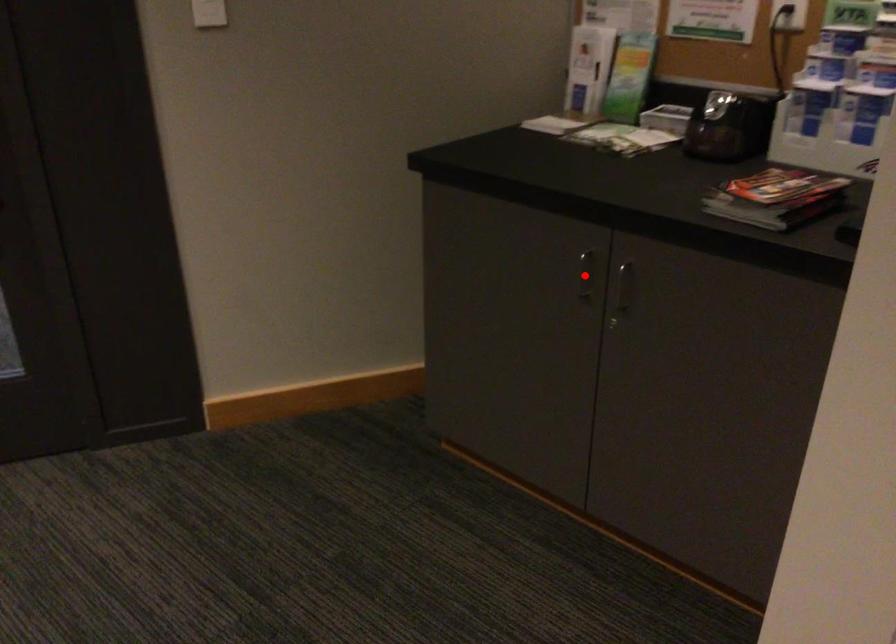
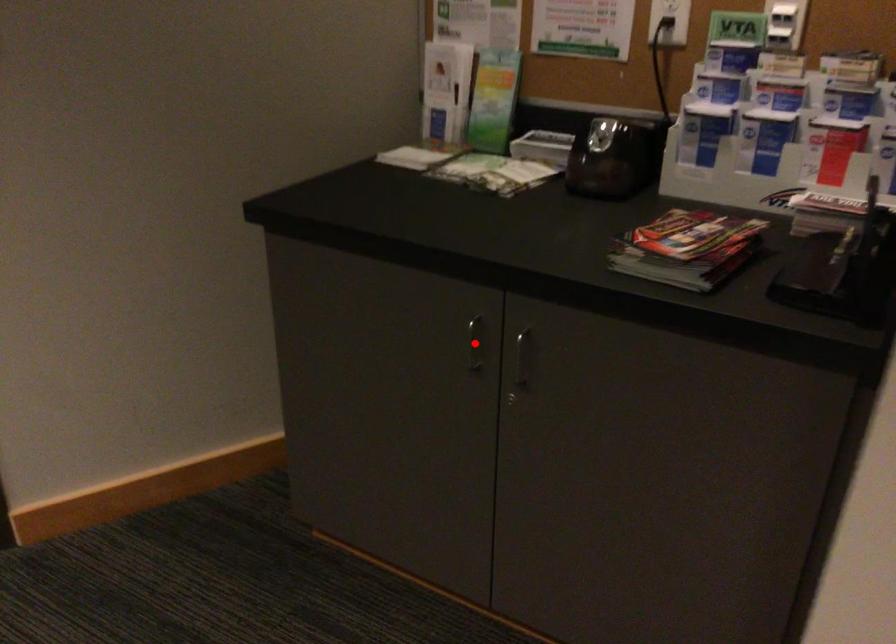
I am providing you with two images of the same scene from different viewpoints. A red point is marked on the first image and another point is marked on the second image. Do the highlighted points in image1 and image2 indicate the same real-world spot?

Yes